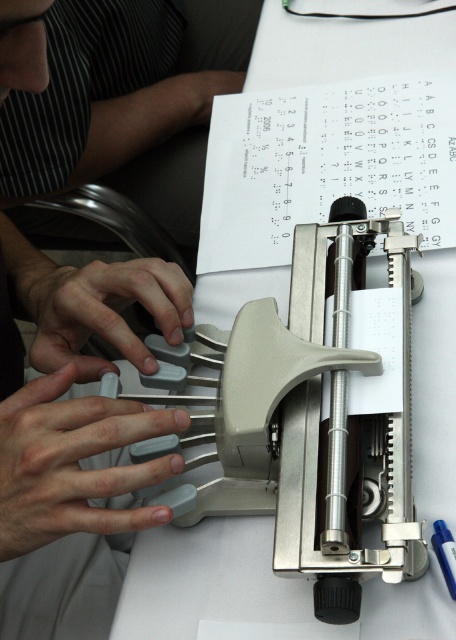
Question: From the image, what is the correct spatial relationship of gray rubberized keys at center in relation to gray rubber keys at center?

Choices:
 (A) left
 (B) right

Answer: (B)

Question: Can you confirm if gray rubberized keys at center is bigger than gray rubber keys at center?

Choices:
 (A) no
 (B) yes

Answer: (A)

Question: Which point appears closest to the camera in this image?

Choices:
 (A) (73, 449)
 (B) (45, 316)

Answer: (A)

Question: Which point is farther to the camera?

Choices:
 (A) gray rubberized keys at center
 (B) gray rubber keys at center

Answer: (B)

Question: Does gray rubberized keys at center appear on the left side of gray rubber keys at center?

Choices:
 (A) yes
 (B) no

Answer: (B)